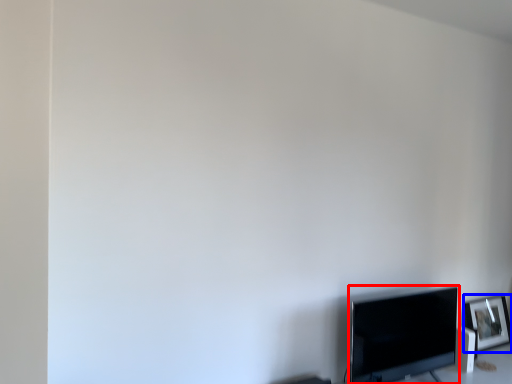
Question: Which point is further to the camera, television (highlighted by a red box) or picture frame (highlighted by a blue box)?

Choices:
 (A) television
 (B) picture frame

Answer: (B)